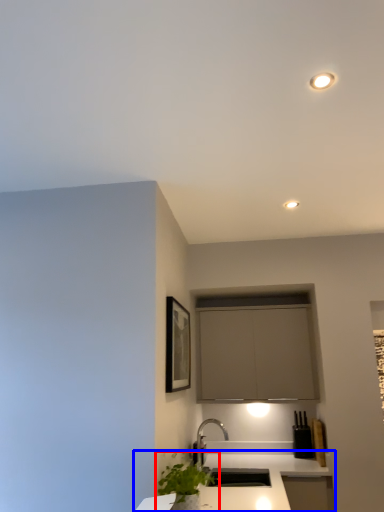
Question: Which point is further to the camera, houseplant (highlighted by a red box) or countertop (highlighted by a blue box)?

Choices:
 (A) houseplant
 (B) countertop

Answer: (A)